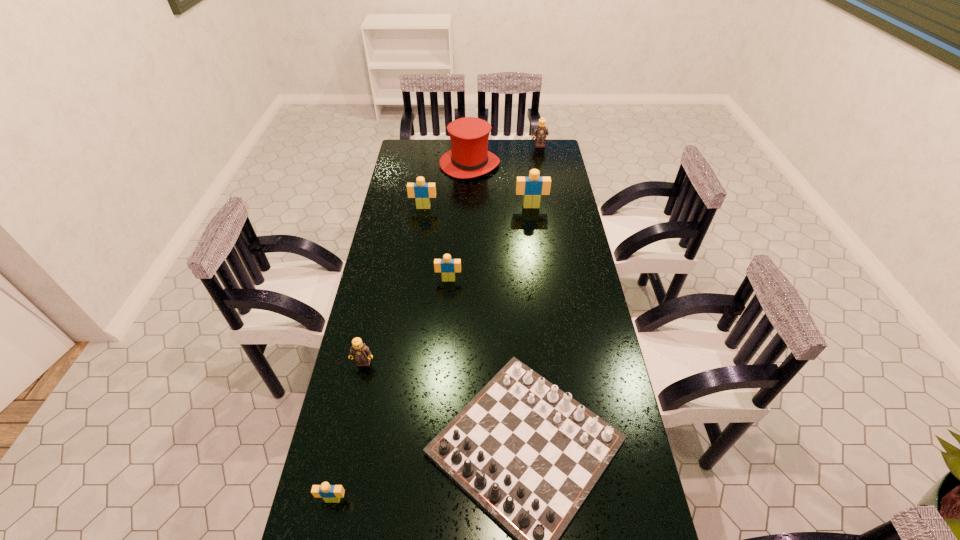
This screenshot has width=960, height=540. What are the coordinates of `hat that is at the far edge` in the screenshot? It's located at (469, 157).

Where is `Lego present at the far edge`? Lego present at the far edge is located at coordinates (540, 131).

Locate an element on the screen. object that is at the far right corner is located at coordinates (540, 131).

Image resolution: width=960 pixels, height=540 pixels. Find the location of `free point at the far edge`. free point at the far edge is located at coordinates (511, 162).

In order to click on vacant space at the left edge of the desktop in this screenshot , I will do `click(332, 457)`.

This screenshot has width=960, height=540. In order to click on free space at the right edge in this screenshot , I will do `click(588, 357)`.

Identify the location of vacant space at the far right corner. This screenshot has height=540, width=960. (547, 140).

Locate an element on the screen. This screenshot has height=540, width=960. free space between the rightmost beige Lego and the second beige Lego from right to left is located at coordinates (490, 243).

This screenshot has height=540, width=960. In order to click on free space between the farthest object and the fifth farthest Lego in this screenshot , I will do `click(451, 254)`.

In order to click on blank region between the second biggest beige Lego and the smaller tan Lego in this screenshot , I will do `click(394, 285)`.